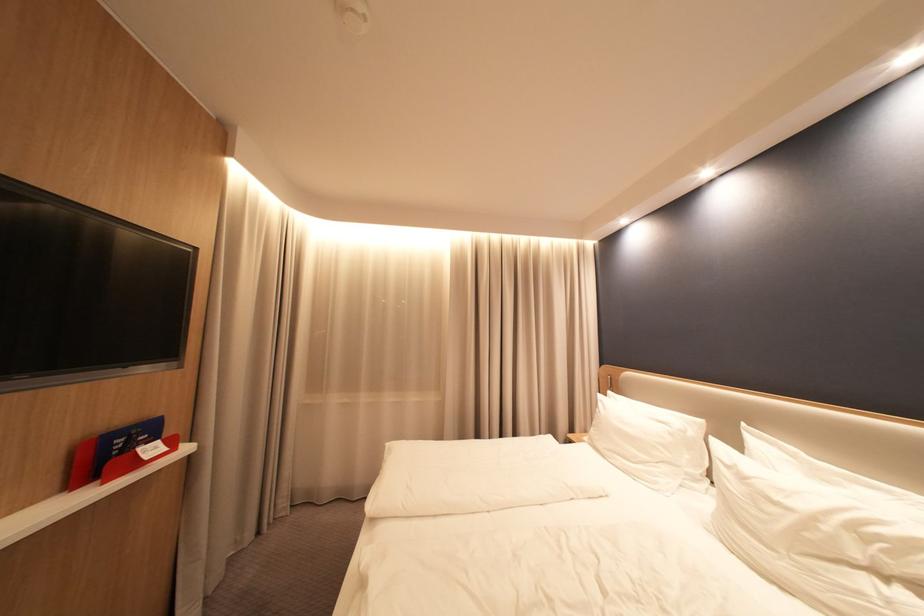
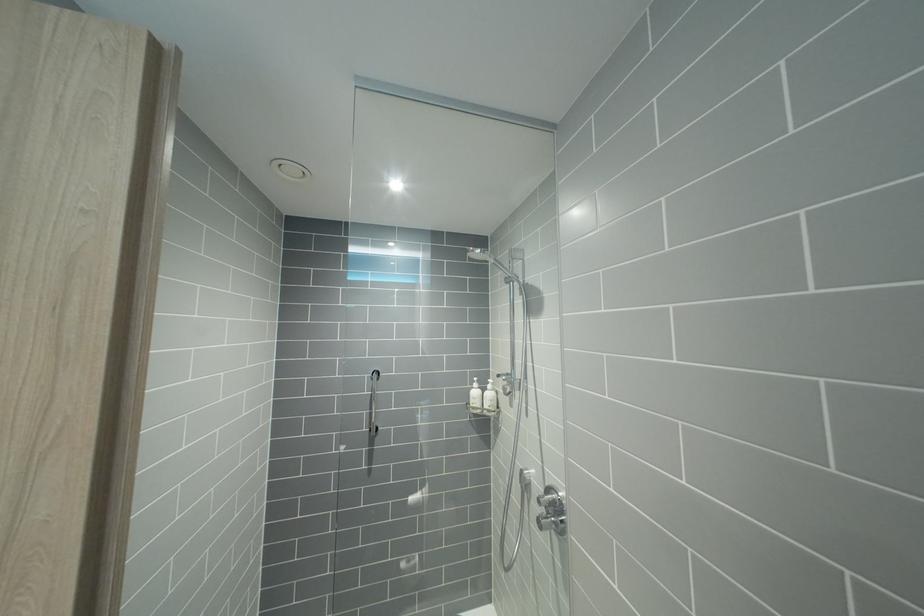
The images are taken continuously from a first-person perspective. In which direction are you moving?

The cameraman moved toward right, backward.